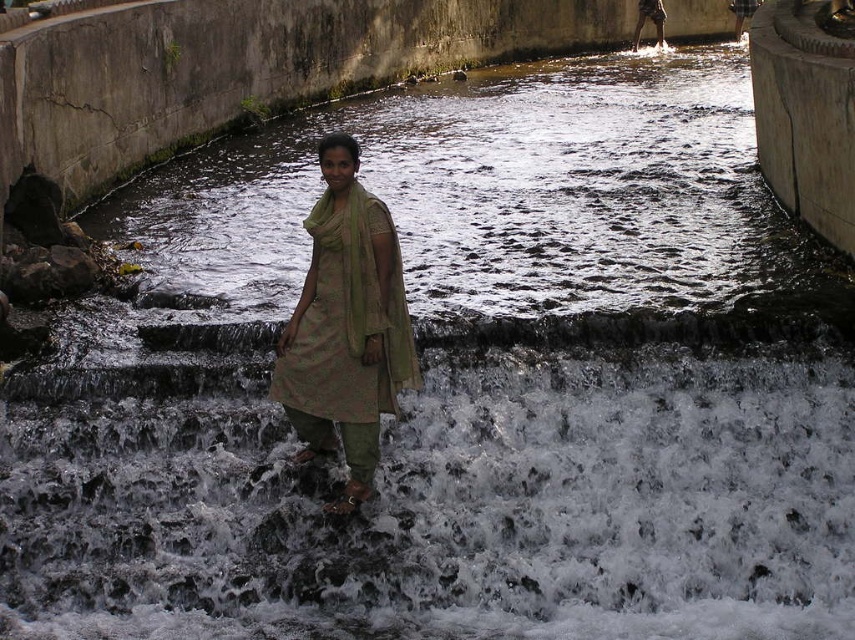
Question: Can you confirm if dark gray concrete waterway at center is positioned below green textured shawl at center?

Choices:
 (A) yes
 (B) no

Answer: (B)

Question: Is dark gray concrete waterway at center below green textured shawl at center?

Choices:
 (A) no
 (B) yes

Answer: (A)

Question: Which of the following is the closest to the observer?

Choices:
 (A) (346, 436)
 (B) (641, 260)

Answer: (A)

Question: Which of the following is the closest to the observer?

Choices:
 (A) (316, 316)
 (B) (358, 323)
 (C) (561, 193)

Answer: (B)

Question: Is dark gray concrete waterway at center to the left of green fabric dress at center from the viewer's perspective?

Choices:
 (A) no
 (B) yes

Answer: (A)

Question: Which object is farther from the camera taking this photo?

Choices:
 (A) green textured shawl at center
 (B) green fabric dress at center

Answer: (A)